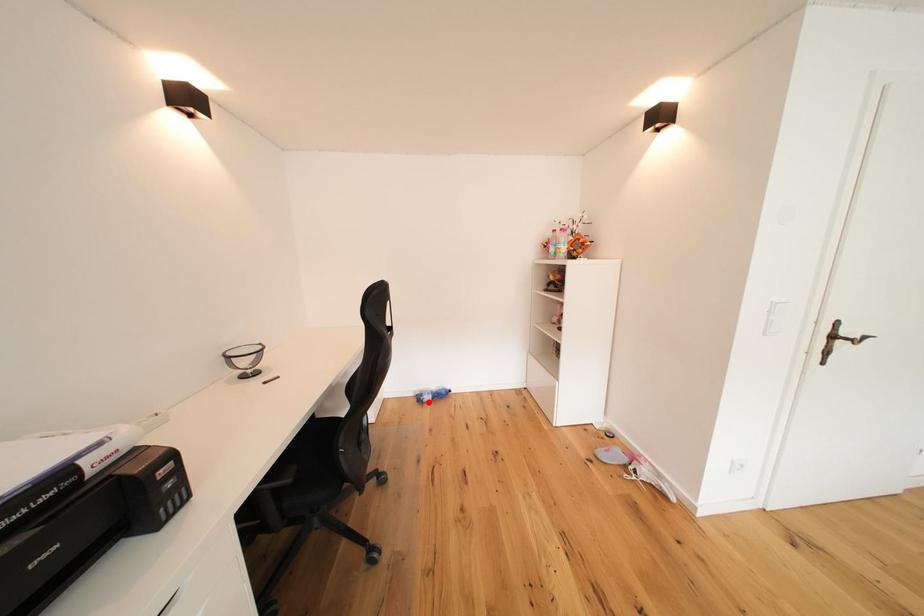
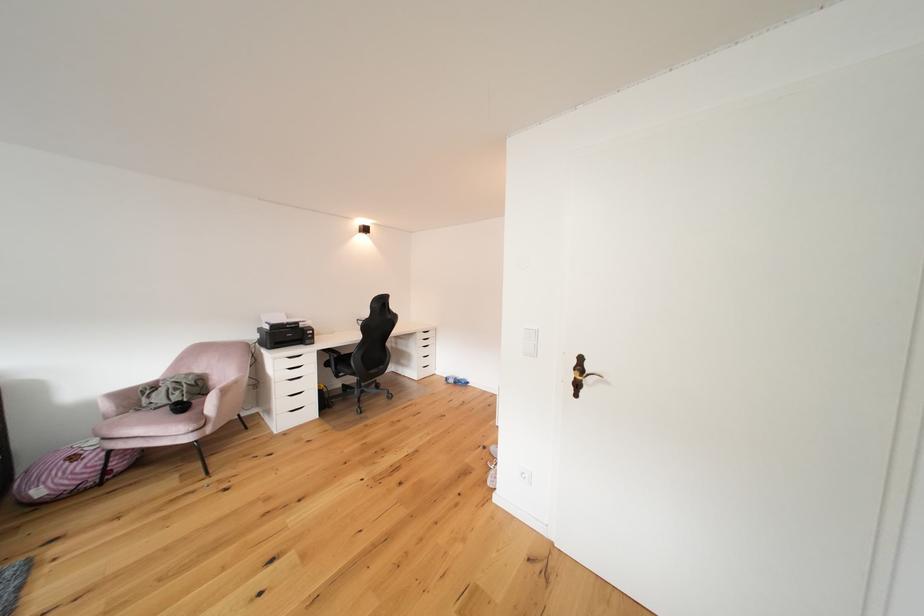
Question: I am providing you with two images of the same scene from different viewpoints. In image1, a red point is highlighted. Considering the same 3D point in image2, which of the following is correct?

Choices:
 (A) It is closer
 (B) It is farther

Answer: (A)